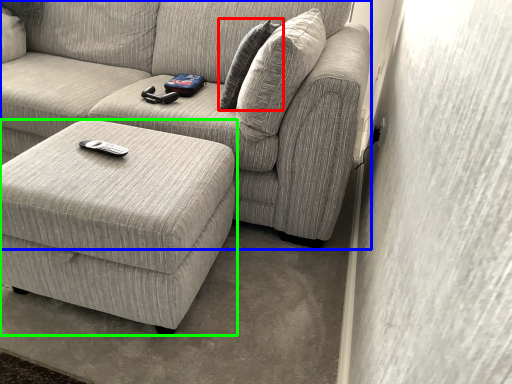
Question: Which object is positioned closest to pillow (highlighted by a red box)? Select from studio couch (highlighted by a blue box) and table (highlighted by a green box).

Choices:
 (A) studio couch
 (B) table

Answer: (A)